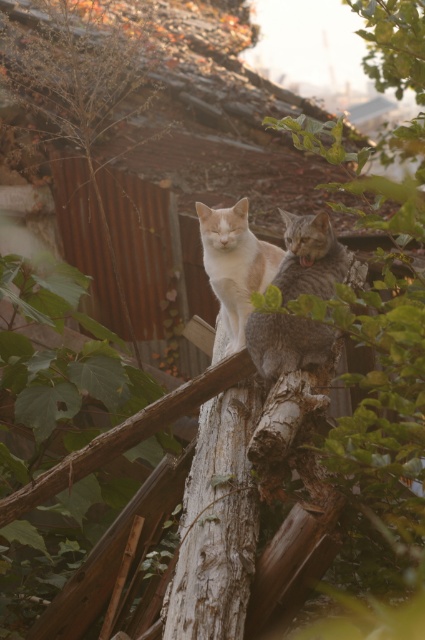
You are a painter who wants to paint both the white textured wood at center and the smooth brown wood at center on the wooden structure. Since you have limited paint, which area requires more paint because it is bigger?

The white textured wood at center requires more paint because it has a larger size compared to the smooth brown wood at center.

You are standing in front of a wooden structure with two cats. You notice two points marked on the structure. The first point is at coordinates point (96,436) and the second is at point (261,269). Which point is closer to you?

Point (96,436) is closer to the viewer than point (261,269).

You are a photographer standing at the base of the wooden structure where the smooth brown wood at center is located. You want to take a photo of both cats without moving your position. Given that your camera has a zoom lens capable of focusing on objects up to 10 feet away, can you capture both cats in a single frame?

The cats are 13.47 feet apart, which exceeds the camera lens range of 10 feet. Therefore, you cannot capture both cats in a single frame without moving your position.